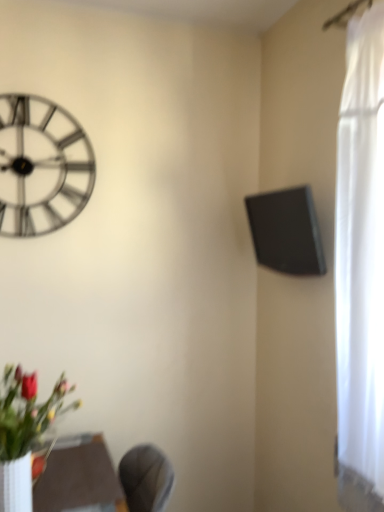
Question: Considering the relative positions of black matte speaker at upper right and matte brown table at lower center in the image provided, is black matte speaker at upper right to the left or to the right of matte brown table at lower center?

Choices:
 (A) right
 (B) left

Answer: (A)

Question: Is black matte speaker at upper right bigger or smaller than matte brown table at lower center?

Choices:
 (A) small
 (B) big

Answer: (A)

Question: Based on their relative distances, which object is nearer to the metallic silver clock at upper left?

Choices:
 (A) black matte speaker at upper right
 (B) matte brown table at lower center

Answer: (A)

Question: Which is nearer to the metallic silver clock at upper left?

Choices:
 (A) black matte speaker at upper right
 (B) matte brown table at lower center

Answer: (A)